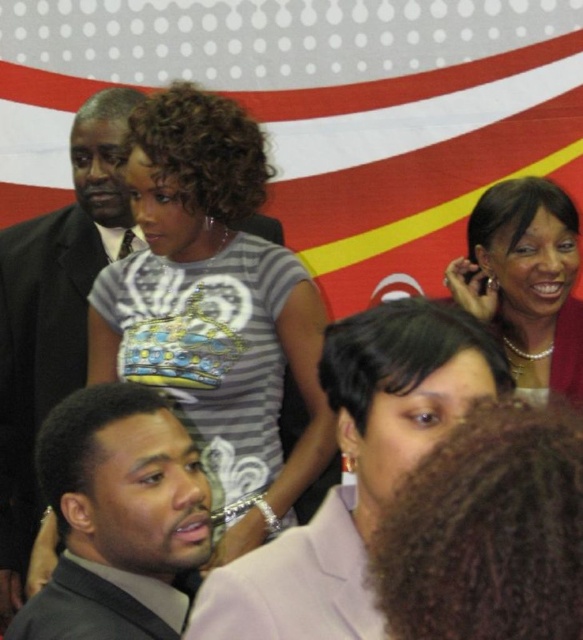
Question: Is dark gray suit at lower left to the right of pearl necklace at upper right from the viewer's perspective?

Choices:
 (A) yes
 (B) no

Answer: (B)

Question: Which point is farther to the camera?

Choices:
 (A) (76, 454)
 (B) (15, 548)
 (C) (510, 358)

Answer: (B)

Question: Which point appears closest to the camera in this image?

Choices:
 (A) (89, 392)
 (B) (135, 96)
 (C) (540, 211)

Answer: (A)

Question: Does dark gray suit at lower left have a smaller size compared to pearl necklace at upper right?

Choices:
 (A) no
 (B) yes

Answer: (A)

Question: Which object appears farthest from the camera in this image?

Choices:
 (A) pearl necklace at upper right
 (B) dark gray suit at lower left
 (C) matte black suit at center

Answer: (C)

Question: Is dark gray suit at lower left smaller than pearl necklace at upper right?

Choices:
 (A) yes
 (B) no

Answer: (B)